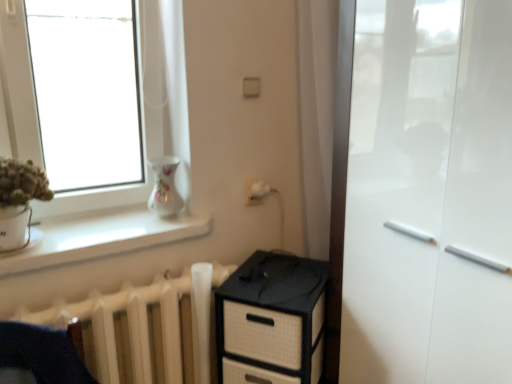
Question: Does point (504, 276) appear closer or farther from the camera than point (272, 322)?

Choices:
 (A) closer
 (B) farther

Answer: (A)

Question: Considering the positions of white glossy cabinet at right and black woven chest of drawers at lower center in the image, is white glossy cabinet at right bigger or smaller than black woven chest of drawers at lower center?

Choices:
 (A) big
 (B) small

Answer: (A)

Question: Considering the real-world distances, which object is farthest from the porcelain floral vase at upper left?

Choices:
 (A) white glossy cabinet at right
 (B) white matte radiator at lower left
 (C) white smooth window sill at lower left
 (D) black woven chest of drawers at lower center

Answer: (A)

Question: Which object is positioned closest to the white glossy cabinet at right?

Choices:
 (A) white smooth window sill at lower left
 (B) white matte radiator at lower left
 (C) porcelain floral vase at upper left
 (D) black woven chest of drawers at lower center

Answer: (D)